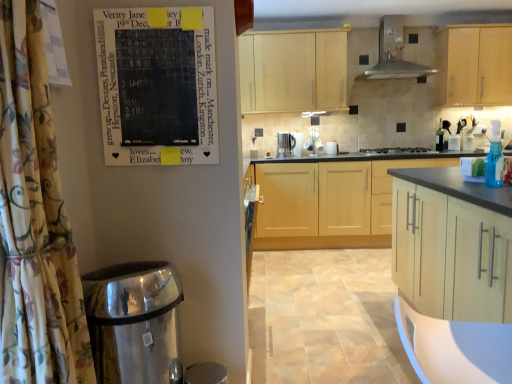
Question: Should I look upward or downward to see light wood cabinet at upper center, which is counted as the first cabinetry, starting from the back?

Choices:
 (A) up
 (B) down

Answer: (A)

Question: Is light wood cabinet at center, which is the 2th cabinetry in front-to-back order, further to the viewer compared to metallic stainless steel range hood at upper center?

Choices:
 (A) no
 (B) yes

Answer: (B)

Question: From a real-world perspective, is light wood cabinet at center, which is the 2th cabinetry in front-to-back order, located higher than metallic stainless steel range hood at upper center?

Choices:
 (A) no
 (B) yes

Answer: (A)

Question: Could you tell me if light wood cabinet at center, placed as the third cabinetry when sorted from back to front, is turned towards metallic stainless steel range hood at upper center?

Choices:
 (A) no
 (B) yes

Answer: (A)

Question: Is light wood cabinet at center, which is the 2th cabinetry in front-to-back order, far away from metallic stainless steel range hood at upper center?

Choices:
 (A) no
 (B) yes

Answer: (B)

Question: Is light wood cabinet at center, which is the 2th cabinetry in front-to-back order, positioned in front of metallic stainless steel range hood at upper center?

Choices:
 (A) yes
 (B) no

Answer: (B)

Question: Is metallic stainless steel range hood at upper center at the back of light wood cabinet at center, placed as the third cabinetry when sorted from back to front?

Choices:
 (A) yes
 (B) no

Answer: (B)

Question: Would you say satin silver coffee maker at center is a long distance from satin silver kettle at center, which is the third appliance from right to left?

Choices:
 (A) yes
 (B) no

Answer: (B)

Question: From the image's perspective, is satin silver coffee maker at center below satin silver kettle at center, which is the third appliance from right to left?

Choices:
 (A) no
 (B) yes

Answer: (B)

Question: Considering the relative sizes of satin silver coffee maker at center and satin silver kettle at center, which is the third appliance from right to left, in the image provided, is satin silver coffee maker at center thinner than satin silver kettle at center, which is the third appliance from right to left,?

Choices:
 (A) yes
 (B) no

Answer: (B)

Question: Can you confirm if satin silver coffee maker at center is positioned to the right of satin silver kettle at center, marked as the first appliance in a left-to-right arrangement?

Choices:
 (A) no
 (B) yes

Answer: (A)

Question: From a real-world perspective, is satin silver coffee maker at center physically above satin silver kettle at center, which is the third appliance from right to left?

Choices:
 (A) yes
 (B) no

Answer: (B)

Question: Does satin silver coffee maker at center have a greater width compared to satin silver kettle at center, marked as the first appliance in a left-to-right arrangement?

Choices:
 (A) yes
 (B) no

Answer: (A)

Question: Is light wood cabinet at upper center, which is counted as the first cabinetry, starting from the back, facing towards satin silver coffee maker at center?

Choices:
 (A) yes
 (B) no

Answer: (B)